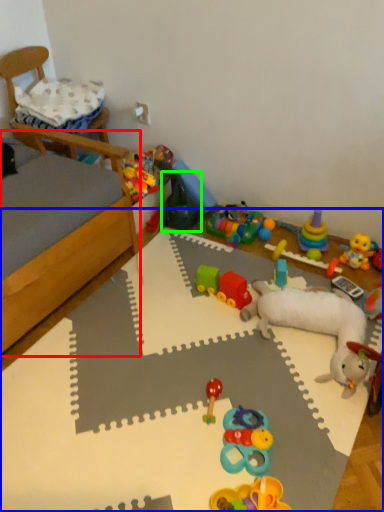
Question: Which is nearer to the bed frame (highlighted by a red box)? table (highlighted by a blue box) or toy (highlighted by a green box).

Choices:
 (A) table
 (B) toy

Answer: (A)